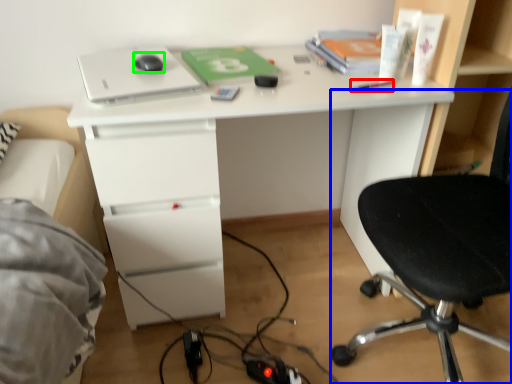
Question: Which object is the farthest from stationery (highlighted by a red box)? Choose among these: chair (highlighted by a blue box) or mouse (highlighted by a green box).

Choices:
 (A) chair
 (B) mouse

Answer: (B)